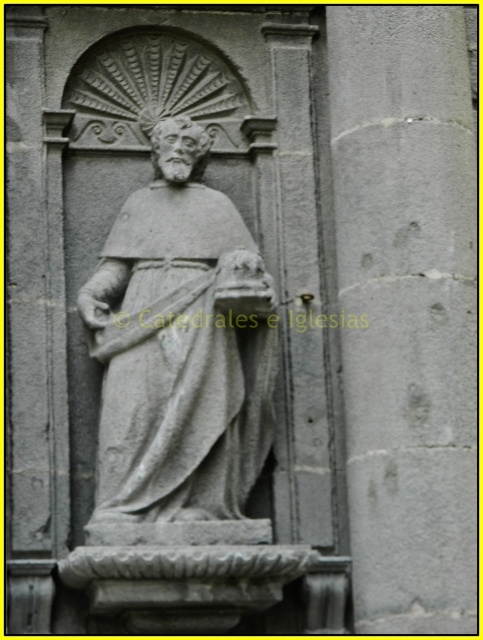
Between point (353, 108) and point (225, 426), which one is positioned in front?

Point (225, 426) is in front.

Does gray stone pillar at center appear under gray stone statue at center?

Actually, gray stone pillar at center is above gray stone statue at center.

The image size is (483, 640). I want to click on gray stone pillar at center, so click(407, 308).